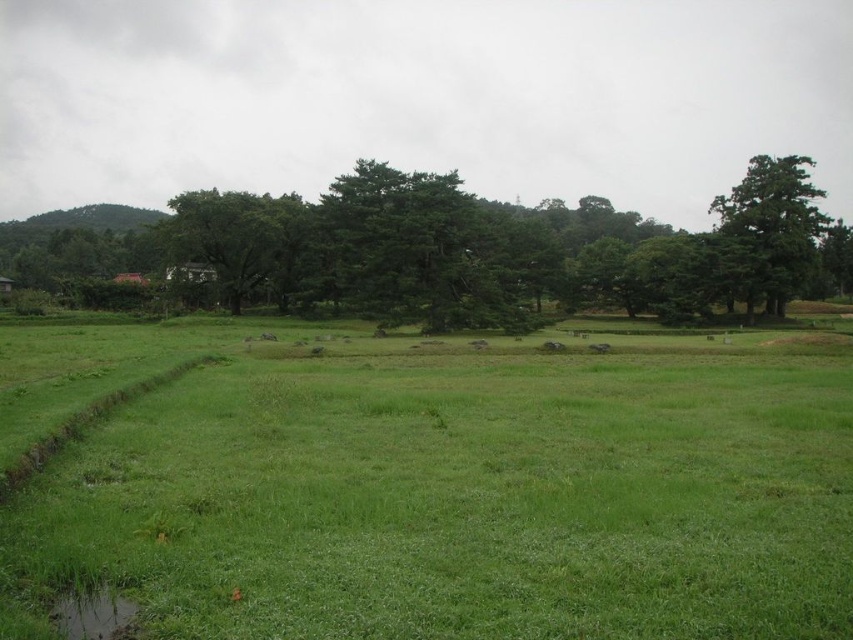
Question: Which point appears farthest from the camera in this image?

Choices:
 (A) (103, 604)
 (B) (281, 232)

Answer: (B)

Question: Which is farther from the green grassy field at center?

Choices:
 (A) green leafy tree at center
 (B) green leafy tree at upper right
 (C) green leafy tree at left
 (D) green grassy puddle at lower left

Answer: (A)

Question: Does green leafy tree at left have a larger size compared to green leafy tree at upper right?

Choices:
 (A) no
 (B) yes

Answer: (B)

Question: Which object is positioned farthest from the green leafy tree at upper right?

Choices:
 (A) green grassy puddle at lower left
 (B) green leafy tree at center
 (C) green leafy tree at left
 (D) green grassy field at center

Answer: (A)

Question: Can you confirm if green leafy tree at left is smaller than green leafy tree at upper right?

Choices:
 (A) no
 (B) yes

Answer: (A)

Question: Can you confirm if green leafy tree at center is thinner than green grassy puddle at lower left?

Choices:
 (A) no
 (B) yes

Answer: (A)